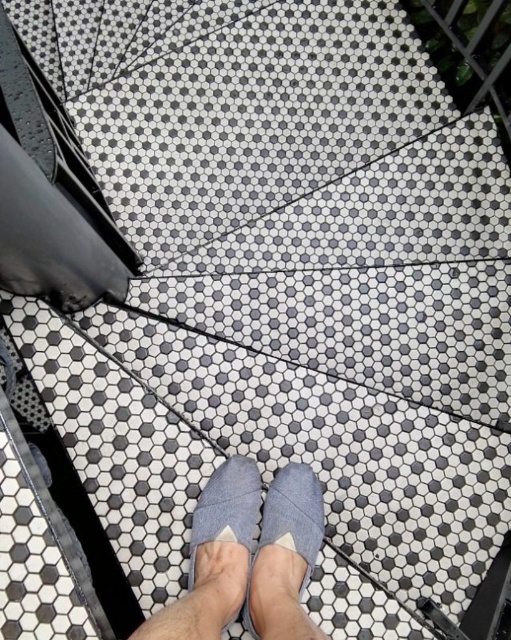
You are standing on the tiled floor and see the gray fabric slipper at center. Can you determine its exact position using the coordinate system provided?

The gray fabric slipper at center is located at point coordinates 0.870 in the x axis and 0.560 in the y axis.

You are standing on the hexagonal tiled floor and see both the gray fabric slipper at center and the gray fabric shoe at center. Which one is bigger in size?

The gray fabric slipper at center is larger in size compared to the gray fabric shoe at center.